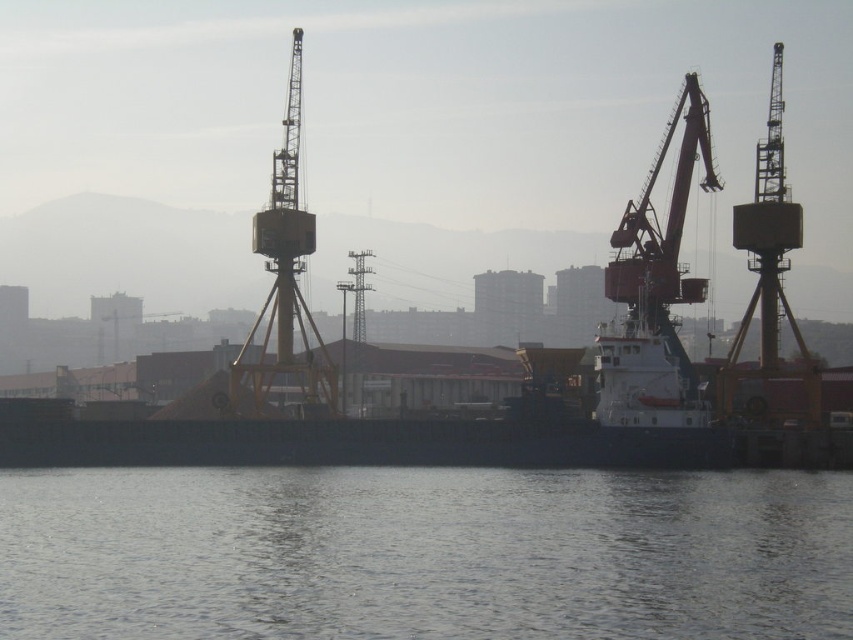
Question: Is clear water at lower center to the right of white matte boat at center from the viewer's perspective?

Choices:
 (A) yes
 (B) no

Answer: (A)

Question: Is clear water at lower center in front of white matte boat at center?

Choices:
 (A) yes
 (B) no

Answer: (A)

Question: Which of the following is the farthest from the observer?

Choices:
 (A) clear water at lower center
 (B) white matte boat at center

Answer: (B)

Question: Which point is closer to the camera taking this photo?

Choices:
 (A) (576, 426)
 (B) (469, 556)

Answer: (B)

Question: Can you confirm if clear water at lower center is positioned below white matte boat at center?

Choices:
 (A) no
 (B) yes

Answer: (B)